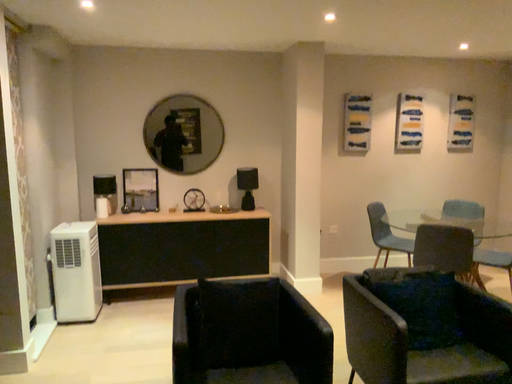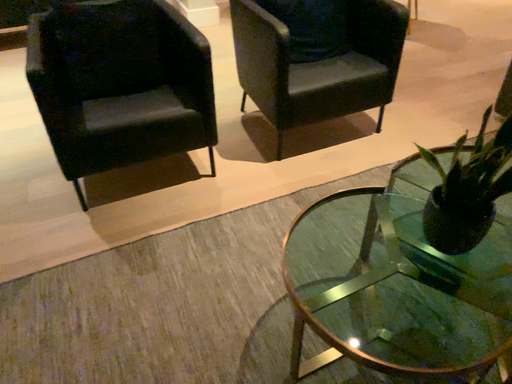
Question: How did the camera likely rotate when shooting the video?

Choices:
 (A) rotated right
 (B) rotated left

Answer: (A)